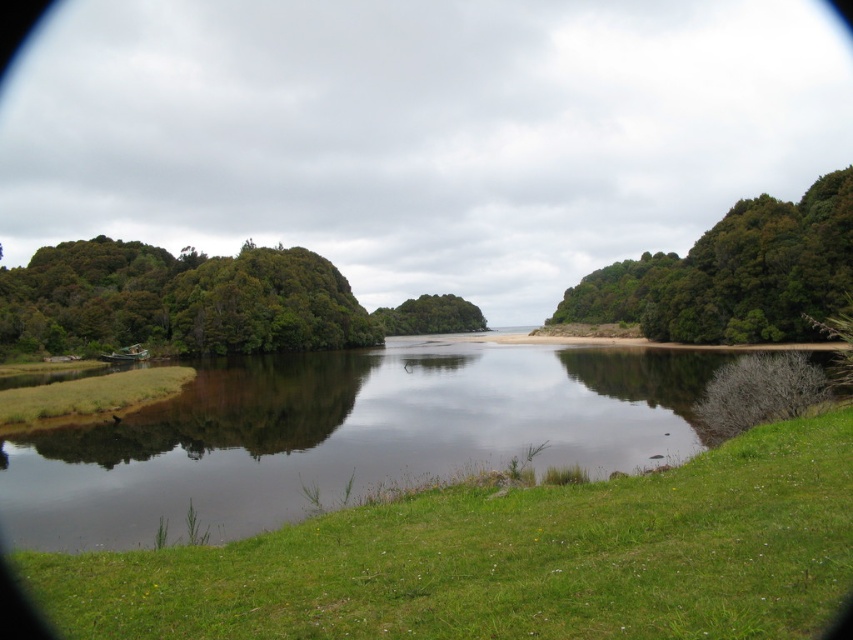
Who is more distant from viewer, (x=165, y=310) or (x=408, y=308)?

The point (x=408, y=308) is more distant.

Is the position of green leafy trees at left less distant than that of green leafy tree at center?

Yes, it is in front of green leafy tree at center.

This screenshot has height=640, width=853. Describe the element at coordinates (198, 301) in the screenshot. I see `green leafy trees at left` at that location.

Image resolution: width=853 pixels, height=640 pixels. In order to click on green leafy trees at left in this screenshot , I will do `click(198, 301)`.

From the picture: Can you confirm if green leafy trees at left is bigger than green leafy tree at upper right?

Indeed, green leafy trees at left has a larger size compared to green leafy tree at upper right.

Find the location of a particular element. Image resolution: width=853 pixels, height=640 pixels. green leafy trees at left is located at coordinates (198, 301).

Who is lower down, green grassy river at center or green leafy tree at upper right?

Positioned lower is green grassy river at center.

Is point (79, 499) farther from viewer compared to point (733, 221)?

No, (79, 499) is closer to viewer.

Is point (405, 410) positioned before point (833, 216)?

Yes, point (405, 410) is in front of point (833, 216).

Locate an element on the screen. green grassy river at center is located at coordinates (344, 435).